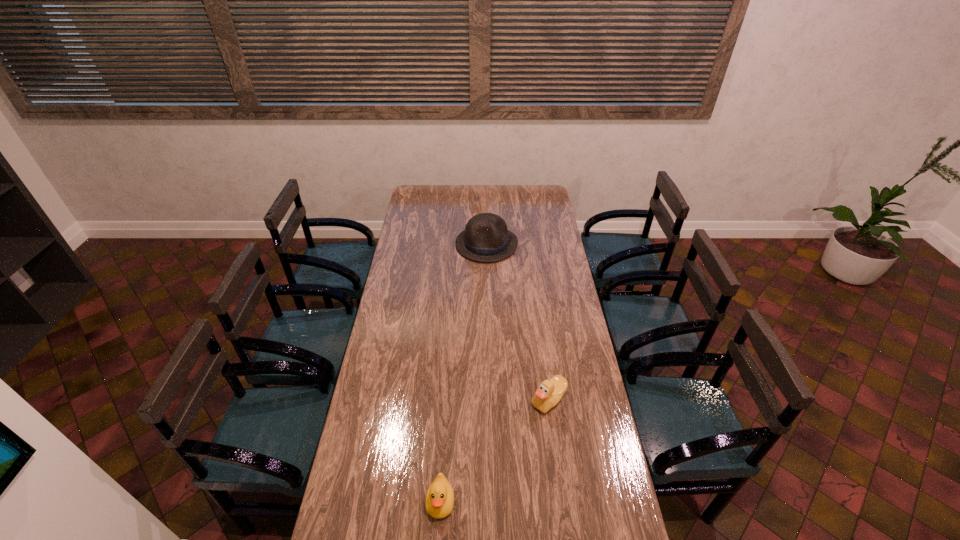
At what (x,y) coordinates should I click in order to perform the action: click on object at the right edge. Please return your answer as a coordinate pair (x, y). Image resolution: width=960 pixels, height=540 pixels. Looking at the image, I should click on pyautogui.click(x=548, y=394).

The width and height of the screenshot is (960, 540). I want to click on vacant area at the far edge of the desktop, so click(x=521, y=205).

At what (x,y) coordinates should I click in order to perform the action: click on free location at the left edge of the desktop. Please return your answer as a coordinate pair (x, y). Image resolution: width=960 pixels, height=540 pixels. Looking at the image, I should click on (408, 308).

You are a GUI agent. You are given a task and a screenshot of the screen. Output one action in this format:
    pyautogui.click(x=<x>, y=<y>)
    Task: Click on the vacant space at the right edge of the desktop
    This screenshot has width=960, height=540.
    Given the screenshot: What is the action you would take?
    pyautogui.click(x=567, y=293)

Image resolution: width=960 pixels, height=540 pixels. I want to click on blank space at the far right corner, so click(544, 194).

You are a GUI agent. You are given a task and a screenshot of the screen. Output one action in this format:
    pyautogui.click(x=<x>, y=<y>)
    Task: Click on the free space between the left duck and the second farthest object
    
    Given the screenshot: What is the action you would take?
    pyautogui.click(x=494, y=450)

Locate an element on the screen. The width and height of the screenshot is (960, 540). vacant space that is in between the tallest object and the nearer duck is located at coordinates (464, 373).

I want to click on vacant area that lies between the nearest object and the tallest object, so click(464, 373).

Where is `free spot between the bowler hat and the nearer duck`? This screenshot has width=960, height=540. free spot between the bowler hat and the nearer duck is located at coordinates (464, 373).

Select which object is the closest to the nearest object. Please provide its 2D coordinates. Your answer should be formatted as a tuple, i.e. [(x, y)], where the tuple contains the x and y coordinates of a point satisfying the conditions above.

[(548, 394)]